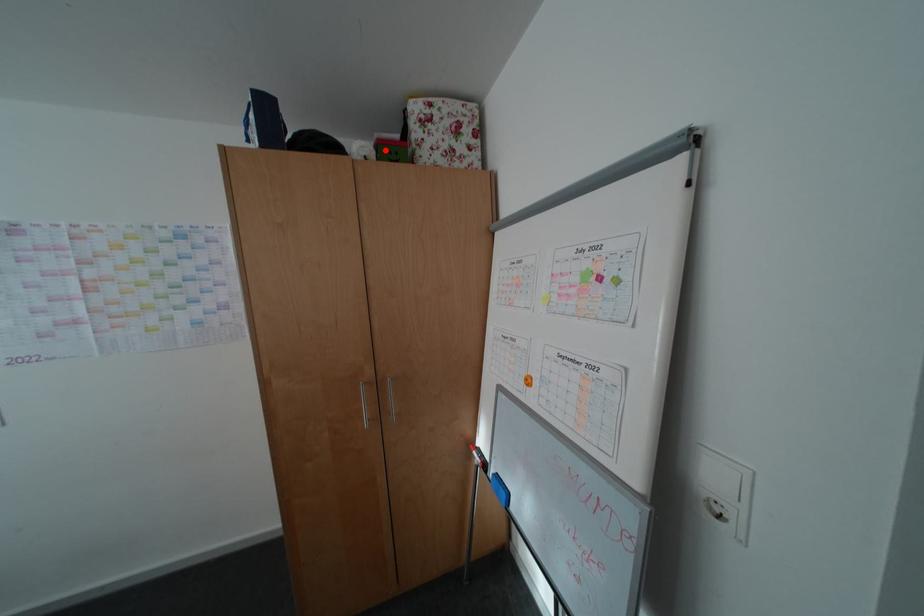
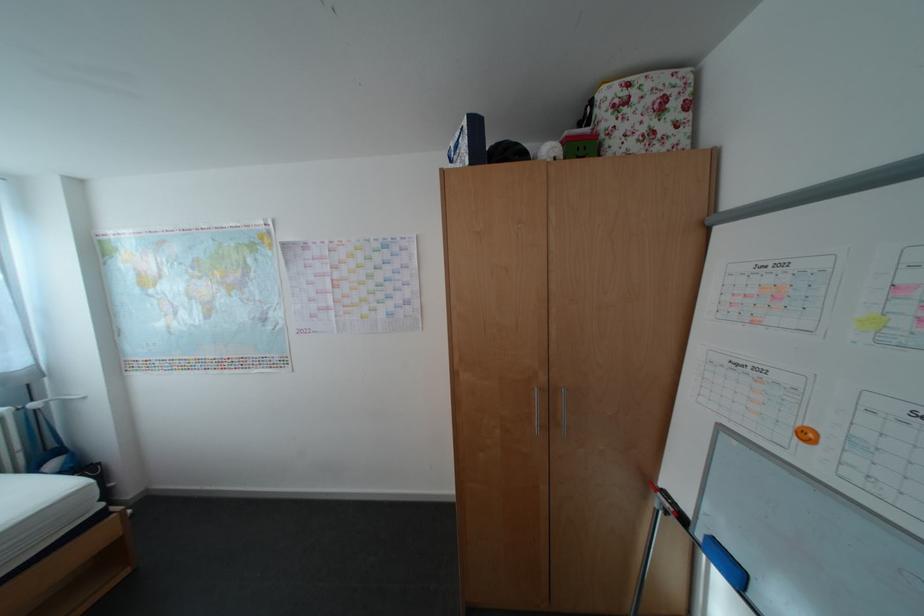
Find the pixel in the second image that matches the highlighted location in the first image.

(574, 148)